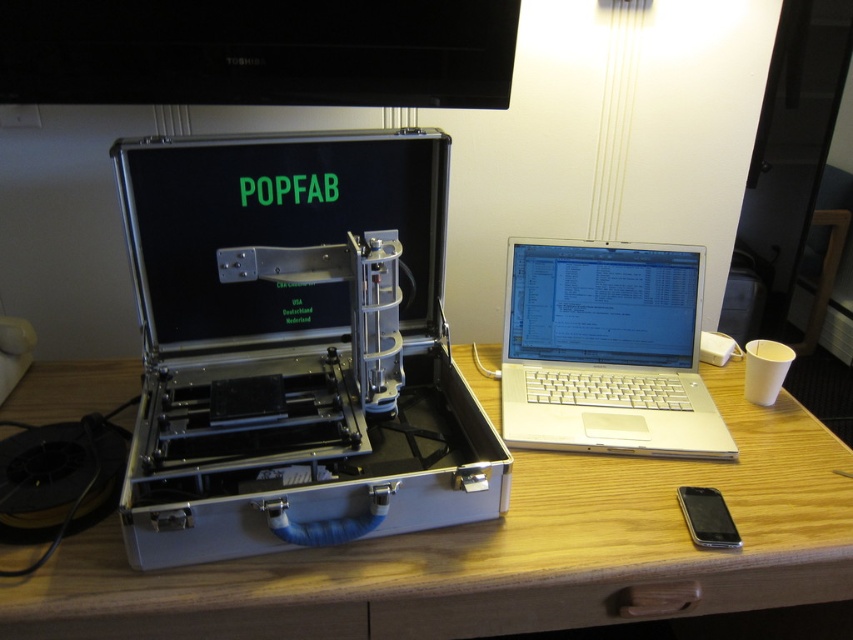
You are setting up a portable 3D printer in your workspace. You have a wooden table at center and a silver metallic laptop at center. Which object is wider?

The wooden table at center is wider than the silver metallic laptop at center according to the description.

You are standing 40 inches away from the briefcase containing the 3D printer. There is a point labeled as point [494,593] in the scene. Can you reach the point without moving closer than 36.93 inches?

The distance of point [494,593] from the camera is 36.93 inches. Since you are currently 40 inches away, you need to move 3.07 inches closer to reach the point, which would be closer than 36.93 inches. Therefore, you cannot reach the point without moving closer than the specified distance.

You are organizing your desk and need to move the silver metallic laptop at center to the right side. Can you slide it past the silver metallic case at center without removing the case from the desk?

The silver metallic case at center is closer to the viewer than the silver metallic laptop at center, so sliding the laptop past the case would require moving it behind the case, which might not be possible if there is insufficient space behind the case. However, since the case is at the center and the laptop is also at the center but further away, adjusting their positions might allow the laptop to be moved to the right side around the case.